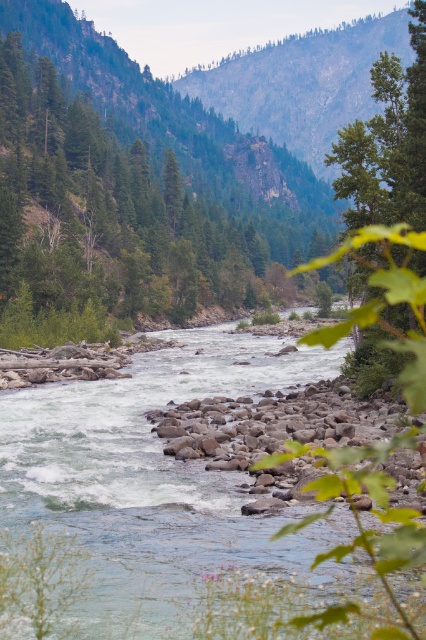
You are a hiker standing on the trail above the river and want to take a photo of the white smooth water at center and the green leafy tree at center. Which object should you focus on first if you want to capture both in your shot?

You should focus on the green leafy tree at center first because the white smooth water at center is positioned under it, so adjusting the focus starting from the tree will ensure both are in frame and properly captured.

You are standing at the edge of the valley looking towards the river. You see the white smooth water at center and the green leafy tree at center. Which one is closer to you?

The white smooth water at center is closer to you because it is in front of the green leafy tree at center.

You are a hiker who wants to cross the river at the center of the image. You notice the white smooth water at center and the green leafy tree at center. Which one is wider? Please answer based on their widths.

The white smooth water at center has a lesser width compared to green leafy tree at center, so the green leafy tree at center is wider.